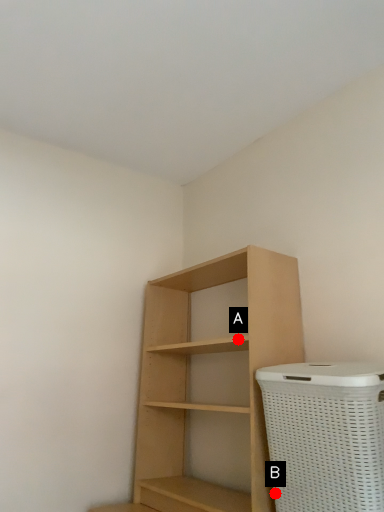
Question: Two points are circled on the image, labeled by A and B beside each circle. Which point is farther to the camera?

Choices:
 (A) A is further
 (B) B is further

Answer: (A)